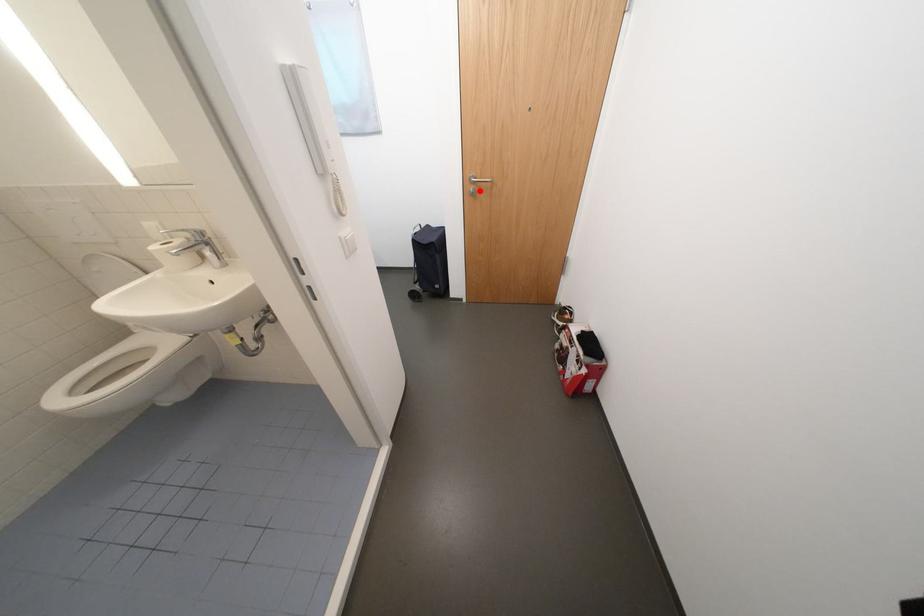
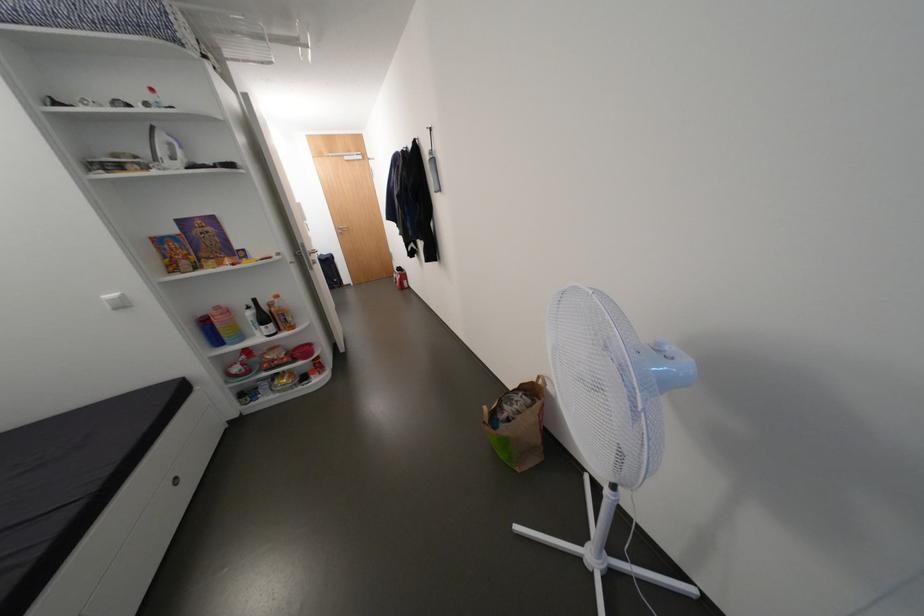
Locate, in the second image, the point that corresponds to the highlighted location in the first image.

(348, 233)